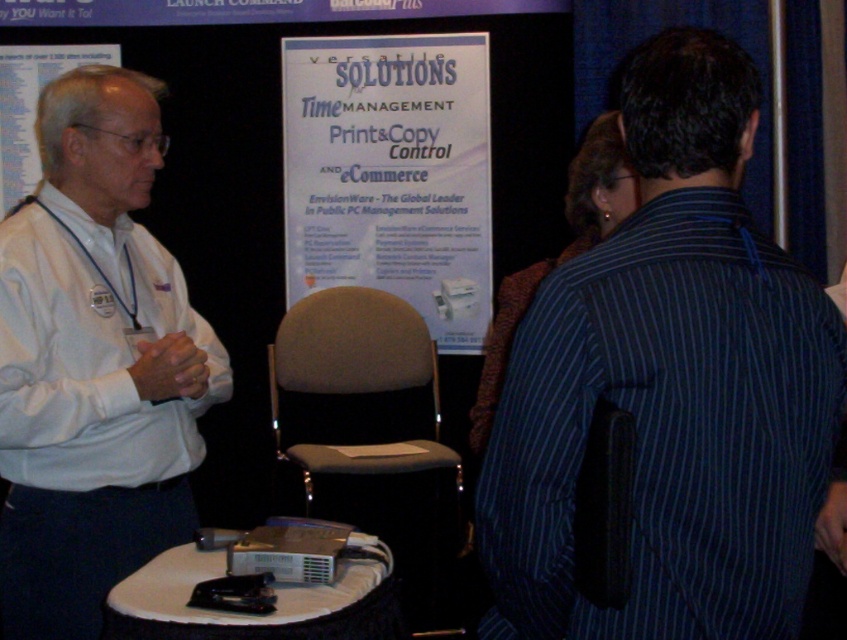
Consider the image. Does dark blue striped shirt at right have a greater width compared to white shirt at left?

Yes, dark blue striped shirt at right is wider than white shirt at left.

Where is `dark blue striped shirt at right`? The height and width of the screenshot is (640, 847). dark blue striped shirt at right is located at coordinates (671, 385).

Does point (735, 150) lie in front of point (70, 440)?

That is True.

Locate an element on the screen. This screenshot has height=640, width=847. dark blue striped shirt at right is located at coordinates (671, 385).

Between white paper at center and white paper at upper left, which one has less height?

white paper at upper left is shorter.

Which is behind, point (322, 262) or point (17, 193)?

The point (322, 262) is more distant.

The height and width of the screenshot is (640, 847). What are the coordinates of `white paper at center` in the screenshot? It's located at (391, 173).

Is dark blue striped shirt at right thinner than white paper at upper left?

No.

You are a GUI agent. You are given a task and a screenshot of the screen. Output one action in this format:
    pyautogui.click(x=<x>, y=<y>)
    Task: Click on the dark blue striped shirt at right
    This screenshot has width=847, height=640.
    Given the screenshot: What is the action you would take?
    pyautogui.click(x=671, y=385)